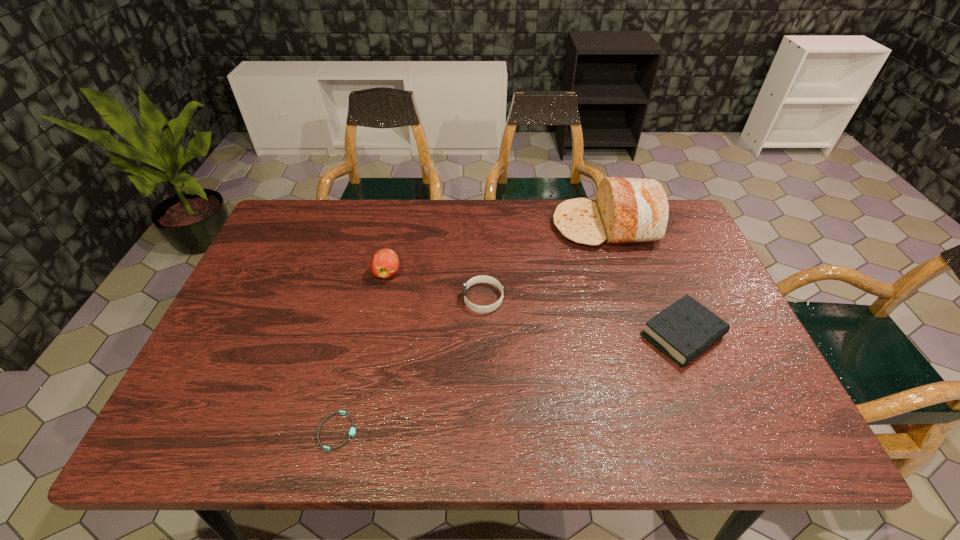
The image size is (960, 540). Identify the location of vacant space that's between the farthest object and the shortest object. (471, 328).

At what (x,y) coordinates should I click in order to perform the action: click on empty space that is in between the farthest object and the fourth shortest object. Please return your answer as a coordinate pair (x, y). This screenshot has height=540, width=960. Looking at the image, I should click on (496, 249).

Image resolution: width=960 pixels, height=540 pixels. Identify the location of vacant area that lies between the nearest object and the Bible. (510, 383).

You are a GUI agent. You are given a task and a screenshot of the screen. Output one action in this format:
    pyautogui.click(x=<x>, y=<y>)
    Task: Click on the free space between the second tallest object and the shortest object
    The image size is (960, 540).
    Given the screenshot: What is the action you would take?
    pyautogui.click(x=363, y=352)

This screenshot has height=540, width=960. In order to click on free space that is in between the nearest object and the right wristband in this screenshot , I will do `click(411, 365)`.

You are a GUI agent. You are given a task and a screenshot of the screen. Output one action in this format:
    pyautogui.click(x=<x>, y=<y>)
    Task: Click on the free space between the bread and the left wristband
    
    Given the screenshot: What is the action you would take?
    pyautogui.click(x=471, y=328)

The image size is (960, 540). Find the location of `free space between the tallest object and the third object from left to right`. free space between the tallest object and the third object from left to right is located at coordinates (544, 262).

At what (x,y) coordinates should I click in order to perform the action: click on free space between the Bible and the right wristband. Please return your answer as a coordinate pair (x, y). Image resolution: width=960 pixels, height=540 pixels. Looking at the image, I should click on (583, 318).

Locate which object ranks second in proximity to the second tallest object. Please provide its 2D coordinates. Your answer should be formatted as a tuple, i.e. [(x, y)], where the tuple contains the x and y coordinates of a point satisfying the conditions above.

[(352, 431)]

Find the location of `the closest object to the third object from right to left`. the closest object to the third object from right to left is located at coordinates (384, 264).